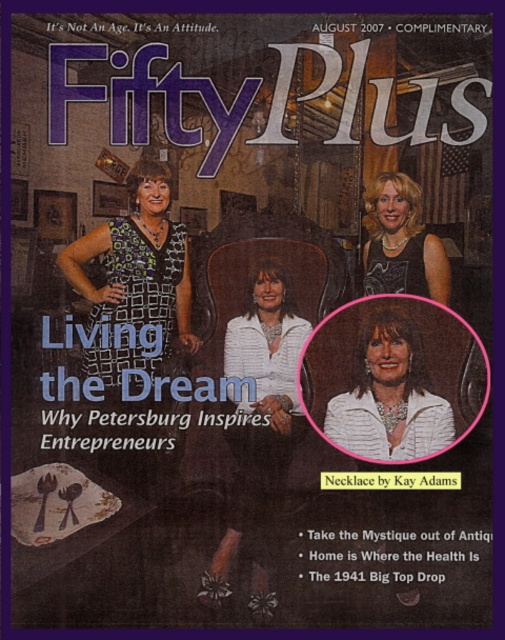
Between printed fabric dress at left and white textured jacket at center, which one has more height?

With more height is printed fabric dress at left.

Can you confirm if printed fabric dress at left is bigger than white textured jacket at center?

Yes, printed fabric dress at left is bigger than white textured jacket at center.

Is point (138, 189) behind point (367, 394)?

No.

You are a GUI agent. You are given a task and a screenshot of the screen. Output one action in this format:
    pyautogui.click(x=<x>, y=<y>)
    Task: Click on the printed fabric dress at left
    This screenshot has height=640, width=505.
    Given the screenshot: What is the action you would take?
    pyautogui.click(x=135, y=278)

Based on the photo, which is below, white matte jacket at center or white textured jacket at center?

white matte jacket at center is below.

The image size is (505, 640). Find the location of `white matte jacket at center`. white matte jacket at center is located at coordinates (259, 410).

Locate an element on the screen. The width and height of the screenshot is (505, 640). white matte jacket at center is located at coordinates (259, 410).

Can you confirm if printed fabric dress at left is smaller than white matte jacket at center?

Correct, printed fabric dress at left occupies less space than white matte jacket at center.

Can you confirm if printed fabric dress at left is taller than white matte jacket at center?

In fact, printed fabric dress at left may be shorter than white matte jacket at center.

Does point (115, 252) lie in front of point (281, 358)?

Yes, point (115, 252) is in front of point (281, 358).

Locate an element on the screen. The height and width of the screenshot is (640, 505). printed fabric dress at left is located at coordinates (135, 278).